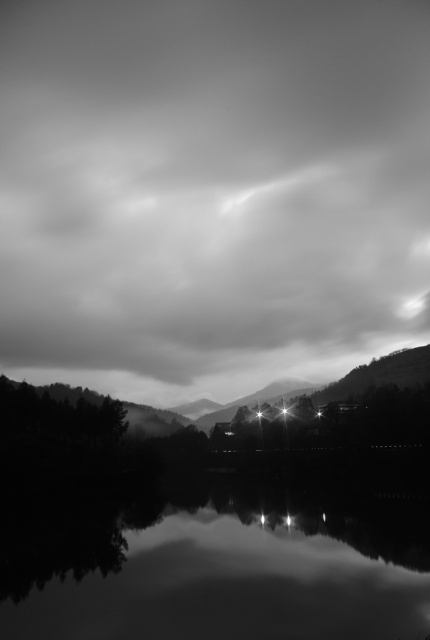
Does cloudy sky at upper center have a larger size compared to smooth water at center?

Indeed, cloudy sky at upper center has a larger size compared to smooth water at center.

What do you see at coordinates (211, 193) in the screenshot?
I see `cloudy sky at upper center` at bounding box center [211, 193].

Identify the location of cloudy sky at upper center. (211, 193).